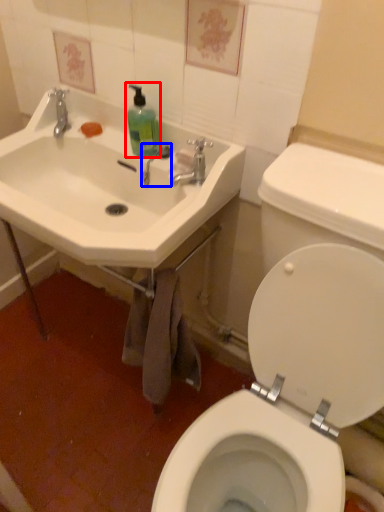
Question: Which point is further to the camera, cleaning product (highlighted by a red box) or plumbing fixture (highlighted by a blue box)?

Choices:
 (A) cleaning product
 (B) plumbing fixture

Answer: (B)